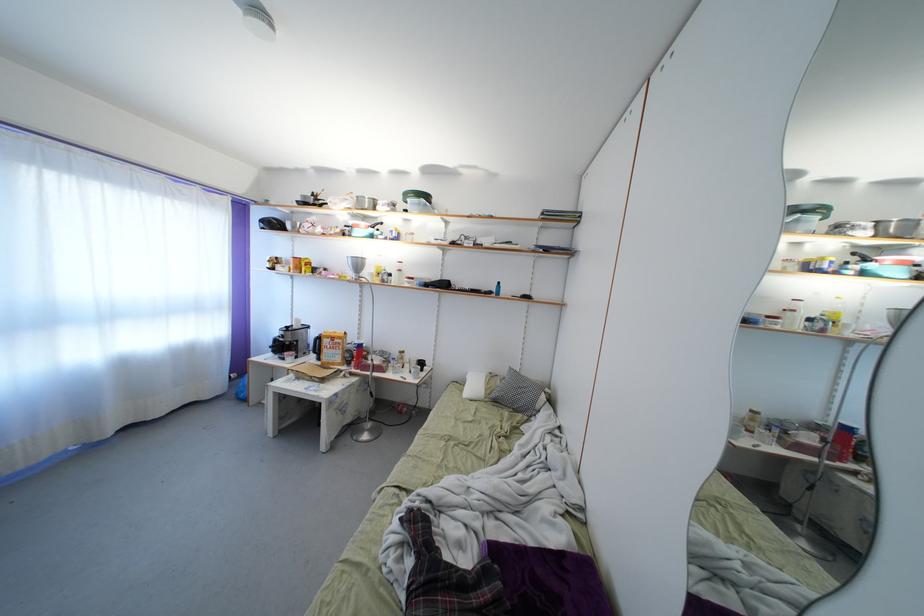
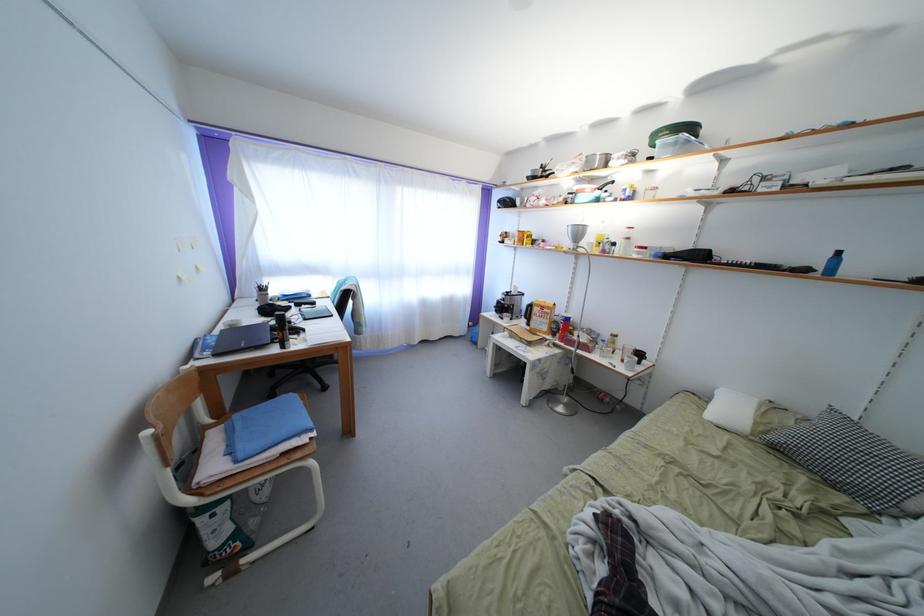
The point at [433,203] is marked in the first image. Where is the corresponding point in the second image?

(698, 134)